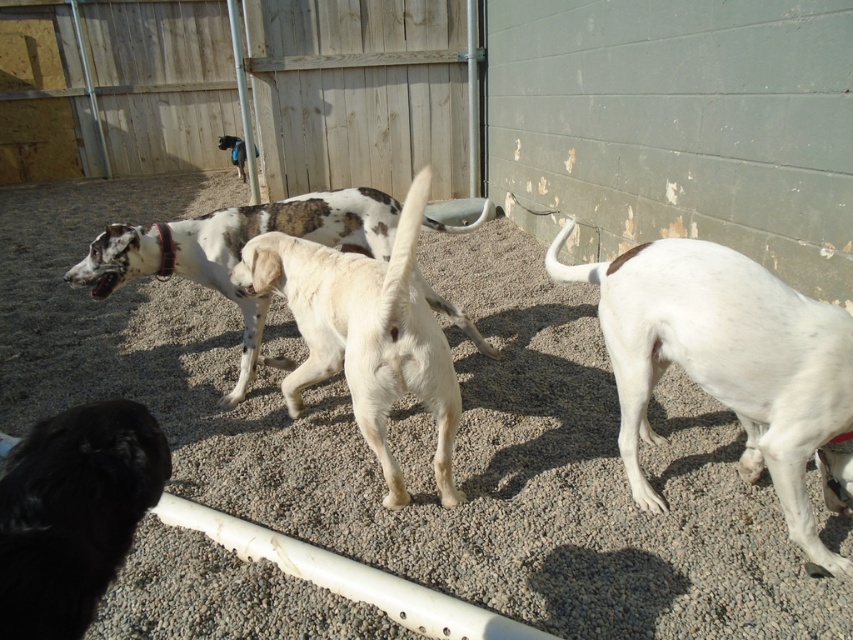
You are a photographer trying to capture a photo of the white smooth dog at right and the spotted fur dog at center. Based on their positions, which dog is closer to the camera?

The white smooth dog at right is closer to the camera because it is positioned below the spotted fur dog at center, indicating it is in a lower and nearer plane.